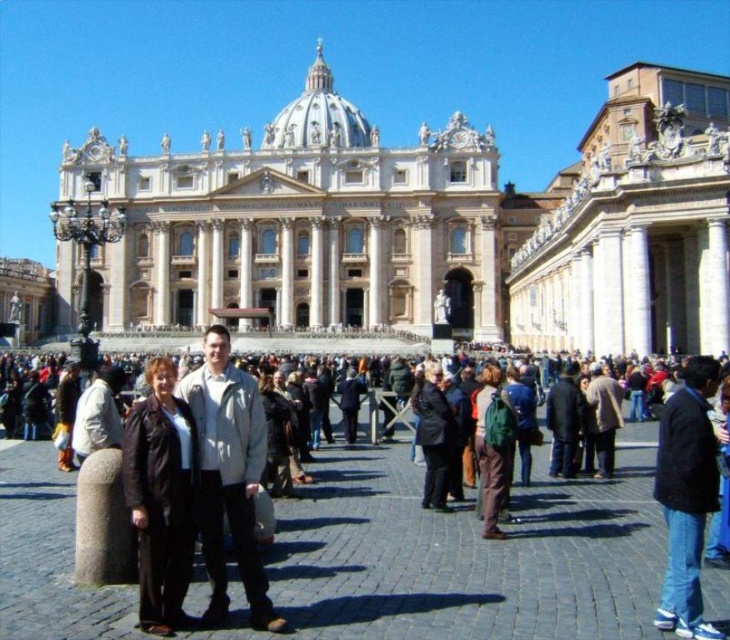
Question: Which point is closer to the camera taking this photo?

Choices:
 (A) (283, 316)
 (B) (661, 628)
 (C) (199, 451)

Answer: (B)

Question: Does white marble palace at center appear on the right side of dark clothing crowd at center?

Choices:
 (A) yes
 (B) no

Answer: (B)

Question: Which object is closer to the camera taking this photo?

Choices:
 (A) dark clothing crowd at center
 (B) light gray jacket at center
 (C) white marble palace at center

Answer: (A)

Question: Which point is closer to the camera?

Choices:
 (A) (685, 384)
 (B) (204, 148)
 (C) (215, 515)
 (D) (1, 624)

Answer: (D)

Question: Does white marble palace at center have a lesser width compared to dark clothing crowd at center?

Choices:
 (A) no
 (B) yes

Answer: (A)

Question: Is white marble palace at center thinner than light gray jacket at center?

Choices:
 (A) yes
 (B) no

Answer: (B)